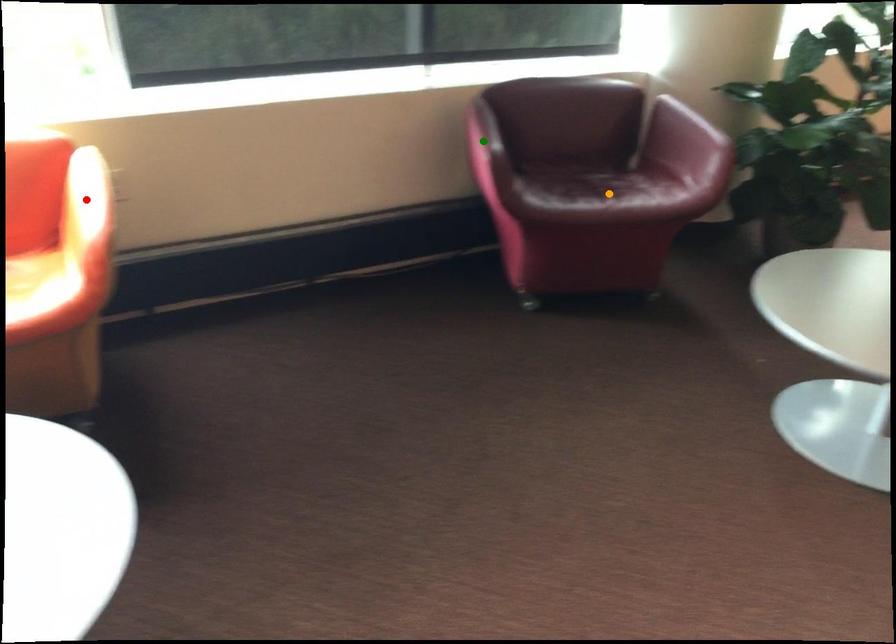
Order these from nearest to farthest:
red point | green point | orange point

red point, green point, orange point